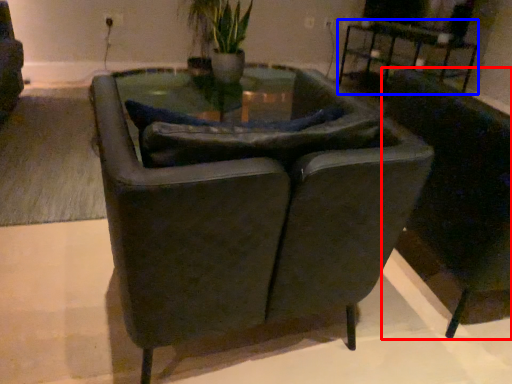
Question: Which object appears farthest to the camera in this image, chair (highlighted by a red box) or table (highlighted by a blue box)?

Choices:
 (A) chair
 (B) table

Answer: (B)